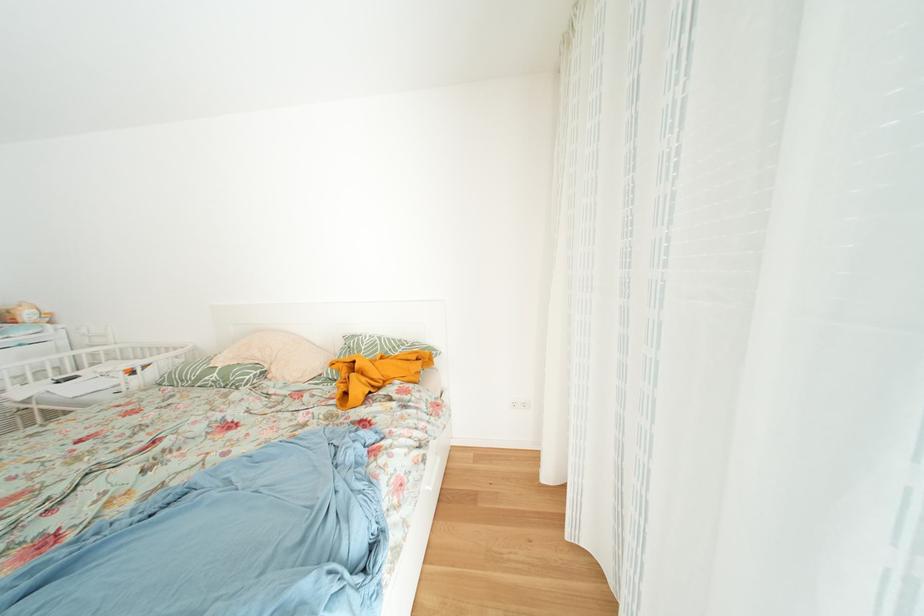
In order to click on green leaf pillow in this screenshot , I will do `click(213, 375)`.